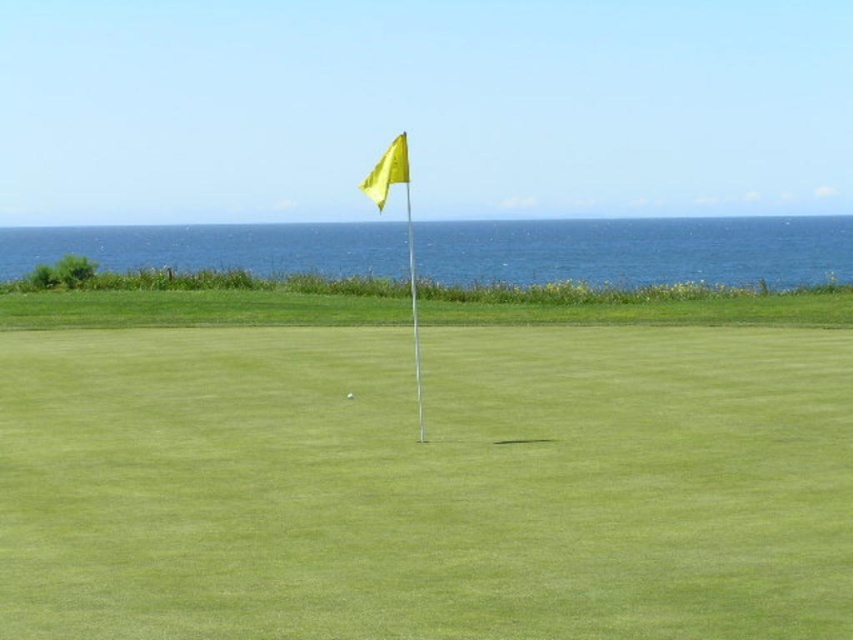
Who is positioned more to the left, yellow fabric flag at center or blue water at upper center?

yellow fabric flag at center is more to the left.

Is yellow fabric flag at center taller than blue water at upper center?

No.

Is point (830, 384) farther from camera compared to point (611, 282)?

No.

Image resolution: width=853 pixels, height=640 pixels. I want to click on yellow fabric flag at center, so click(424, 472).

Which is behind, point (457, 221) or point (349, 397)?

Positioned behind is point (457, 221).

Locate an element on the screen. This screenshot has height=640, width=853. blue water at upper center is located at coordinates (637, 250).

In the scene shown: Measure the distance between blue water at upper center and camera.

blue water at upper center is 121.58 meters from camera.

The image size is (853, 640). In order to click on blue water at upper center in this screenshot , I will do `click(637, 250)`.

Is yellow fabric flag at center shorter than white matte golf at center?

No.

Describe the element at coordinates (424, 472) in the screenshot. The height and width of the screenshot is (640, 853). I see `yellow fabric flag at center` at that location.

Find the location of a particular element. yellow fabric flag at center is located at coordinates (424, 472).